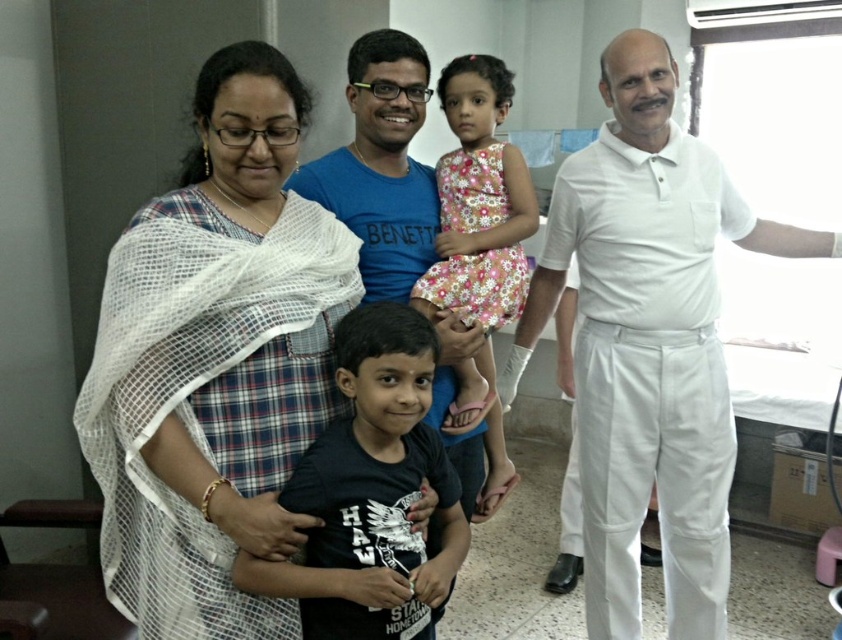
You are a nurse in a hospital and need to locate the white cotton shirt at right. According to the coordinates provided, where exactly should you look to find it?

The white cotton shirt at right is located at point [649,342].

You are a photographer in a hospital room and need to position the black matte shirt at center and the floral dress at center for a photo. Based on their current positions, which one should you move to the right to align them side by side?

The black matte shirt at center is currently to the left of the floral dress at center. To align them side by side, move the black matte shirt at center to the right so it is next to the floral dress at center.